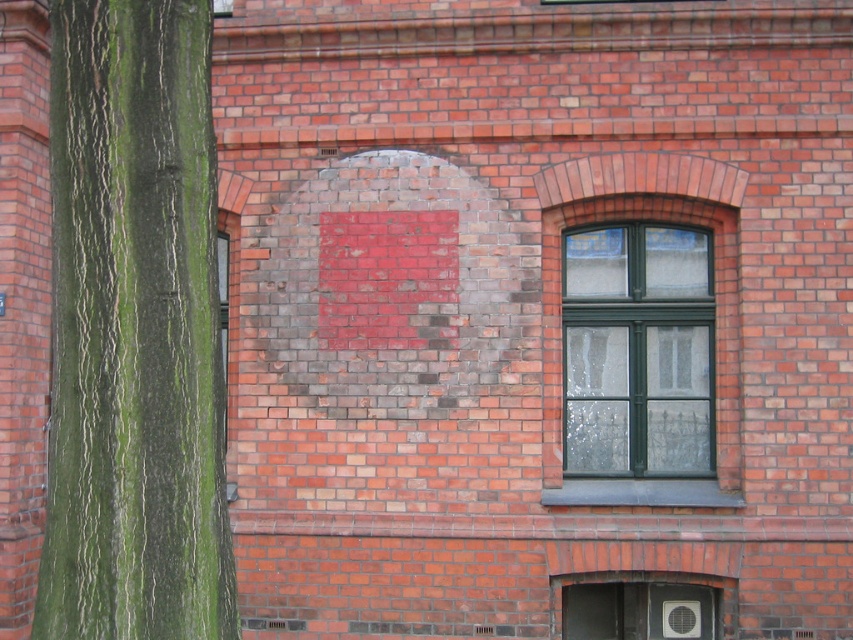
Is green rough bark tree trunk at left positioned in front of green glass window at center?

Yes, green rough bark tree trunk at left is closer to the viewer.

Who is higher up, green rough bark tree trunk at left or green glass window at center?

green rough bark tree trunk at left is higher up.

You are a GUI agent. You are given a task and a screenshot of the screen. Output one action in this format:
    pyautogui.click(x=<x>, y=<y>)
    Task: Click on the green rough bark tree trunk at left
    Image resolution: width=853 pixels, height=640 pixels.
    Given the screenshot: What is the action you would take?
    [x=134, y=330]

Locate an element on the screen. This screenshot has width=853, height=640. green rough bark tree trunk at left is located at coordinates (134, 330).